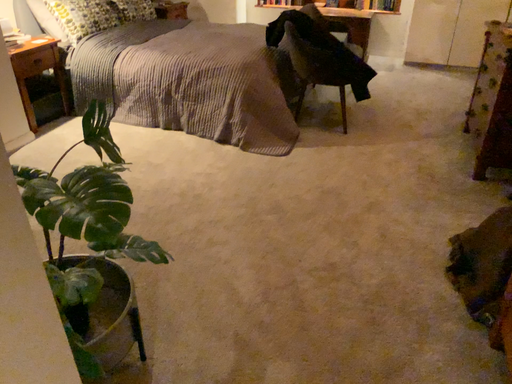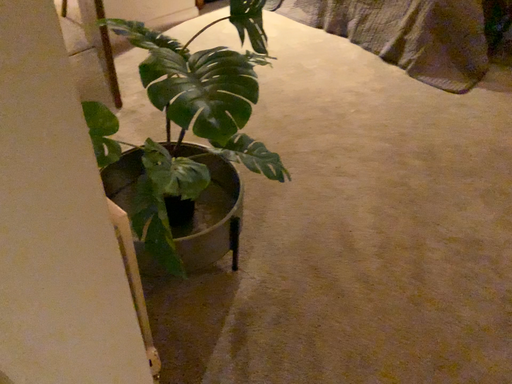
Question: How did the camera likely rotate when shooting the video?

Choices:
 (A) rotated downward
 (B) rotated upward

Answer: (A)